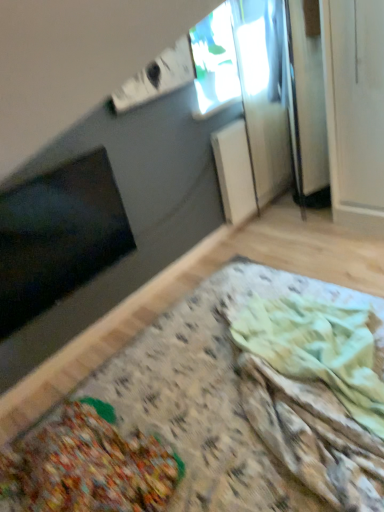
Question: From the image's perspective, does wooden table at lower left appear higher than transparent glass window at upper center?

Choices:
 (A) no
 (B) yes

Answer: (A)

Question: Is wooden table at lower left thinner than transparent glass window at upper center?

Choices:
 (A) yes
 (B) no

Answer: (B)

Question: Does wooden table at lower left have a lesser height compared to transparent glass window at upper center?

Choices:
 (A) yes
 (B) no

Answer: (B)

Question: From a real-world perspective, is wooden table at lower left positioned over transparent glass window at upper center based on gravity?

Choices:
 (A) no
 (B) yes

Answer: (A)

Question: Can you confirm if wooden table at lower left is smaller than transparent glass window at upper center?

Choices:
 (A) no
 (B) yes

Answer: (A)

Question: From the image's perspective, relative to textured fabric blanket at lower center, is wooden table at lower left above or below?

Choices:
 (A) above
 (B) below

Answer: (A)

Question: In terms of width, does wooden table at lower left look wider or thinner when compared to textured fabric blanket at lower center?

Choices:
 (A) wide
 (B) thin

Answer: (A)

Question: Is point (332, 437) closer or farther from the camera than point (294, 352)?

Choices:
 (A) farther
 (B) closer

Answer: (B)

Question: In terms of size, does wooden table at lower left appear bigger or smaller than textured fabric blanket at lower center?

Choices:
 (A) big
 (B) small

Answer: (A)

Question: Looking at their shapes, would you say textured fabric blanket at lower center is wider or thinner than black matte window screen at lower left?

Choices:
 (A) thin
 (B) wide

Answer: (B)

Question: Would you say textured fabric blanket at lower center is to the left or to the right of black matte window screen at lower left in the picture?

Choices:
 (A) left
 (B) right

Answer: (B)

Question: Is textured fabric blanket at lower center inside the boundaries of black matte window screen at lower left, or outside?

Choices:
 (A) inside
 (B) outside

Answer: (B)

Question: From a real-world perspective, is textured fabric blanket at lower center above or below black matte window screen at lower left?

Choices:
 (A) below
 (B) above

Answer: (A)

Question: From their relative heights in the image, would you say black matte window screen at lower left is taller or shorter than wooden table at lower left?

Choices:
 (A) tall
 (B) short

Answer: (B)

Question: Would you say black matte window screen at lower left is to the left or to the right of wooden table at lower left in the picture?

Choices:
 (A) left
 (B) right

Answer: (A)